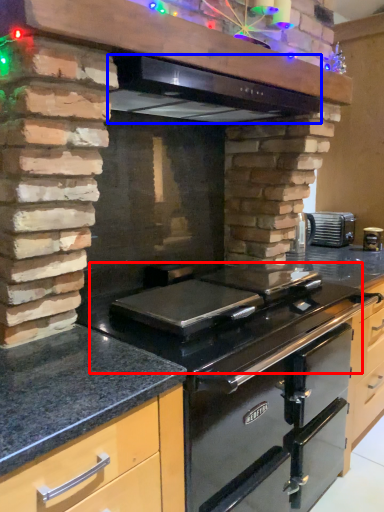
Question: Which point is further to the camera, gas stove (highlighted by a red box) or exhaust hood (highlighted by a blue box)?

Choices:
 (A) gas stove
 (B) exhaust hood

Answer: (B)